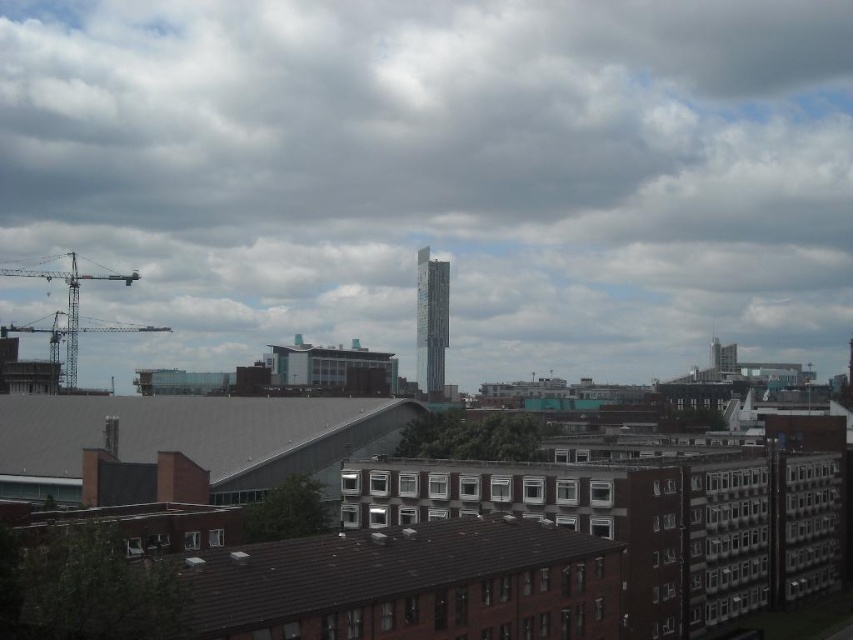
From the picture: You are a city planner reviewing this area. You need to determine if the gray concrete construction site at center will be visible from the white fluffy cloud at upper center. Based on their positions, can you see the construction site from the cloud?

The white fluffy cloud at upper center is positioned over the gray concrete construction site at center, so yes, the construction site would be visible from the cloud as it is directly below the cloud.

You are an architect observing the cityscape. You notice the white fluffy cloud at upper center and the metallic gray crane at left. Which object is positioned higher in the sky?

The white fluffy cloud at upper center is positioned higher in the sky than the metallic gray crane at left because it is above it.